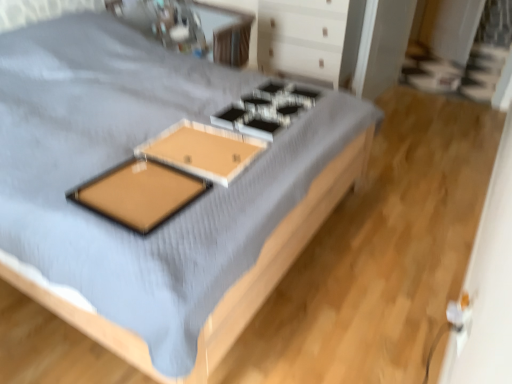
Question: Is wooden bed at center with wooden tray at center, which is the 1th table in bottom-to-top order?

Choices:
 (A) no
 (B) yes

Answer: (A)

Question: From the image's perspective, does wooden bed at center appear lower than wooden tray at center, which is the 1th table in bottom-to-top order?

Choices:
 (A) yes
 (B) no

Answer: (A)

Question: Could you tell me if wooden bed at center is facing wooden tray at center, arranged as the 2th table when viewed from the top?

Choices:
 (A) no
 (B) yes

Answer: (A)

Question: Is wooden bed at center further to camera compared to wooden tray at center, arranged as the 2th table when viewed from the top?

Choices:
 (A) yes
 (B) no

Answer: (B)

Question: Is wooden bed at center at the right side of wooden tray at center, marked as the 2th table in a back-to-front arrangement?

Choices:
 (A) yes
 (B) no

Answer: (A)

Question: Is wooden bed at center thinner than wooden tray at center, which is the 1th table in bottom-to-top order?

Choices:
 (A) yes
 (B) no

Answer: (B)

Question: From a real-world perspective, does brown matte board at center stand above wooden tray at upper center, the 1th table positioned from the back?

Choices:
 (A) yes
 (B) no

Answer: (A)

Question: From the image's perspective, is brown matte board at center located beneath wooden tray at upper center, placed as the 1th table when sorted from top to bottom?

Choices:
 (A) yes
 (B) no

Answer: (A)

Question: Is brown matte board at center turned away from wooden tray at upper center, positioned as the second table in bottom-to-top order?

Choices:
 (A) no
 (B) yes

Answer: (A)

Question: Does brown matte board at center have a smaller size compared to wooden tray at upper center, the 1th table positioned from the back?

Choices:
 (A) no
 (B) yes

Answer: (B)

Question: Considering the relative positions of brown matte board at center and wooden tray at upper center, the 1th table positioned from the back, in the image provided, is brown matte board at center behind wooden tray at upper center, the 1th table positioned from the back,?

Choices:
 (A) no
 (B) yes

Answer: (A)

Question: Does brown matte board at center have a greater width compared to wooden tray at upper center, the 1th table positioned from the back?

Choices:
 (A) no
 (B) yes

Answer: (A)

Question: Is metallic silver gas stove at center inside white glossy drawer at upper center?

Choices:
 (A) yes
 (B) no

Answer: (B)